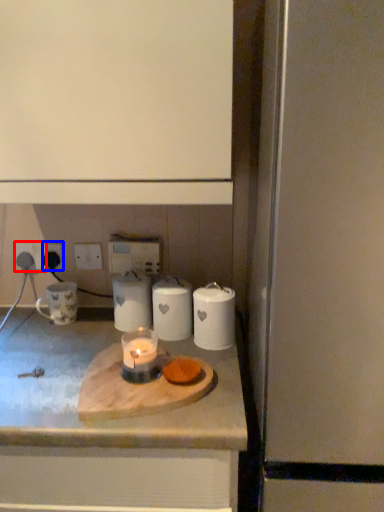
Question: Which of the following is the farthest to the observer, electric outlet (highlighted by a red box) or electric outlet (highlighted by a blue box)?

Choices:
 (A) electric outlet
 (B) electric outlet

Answer: (A)